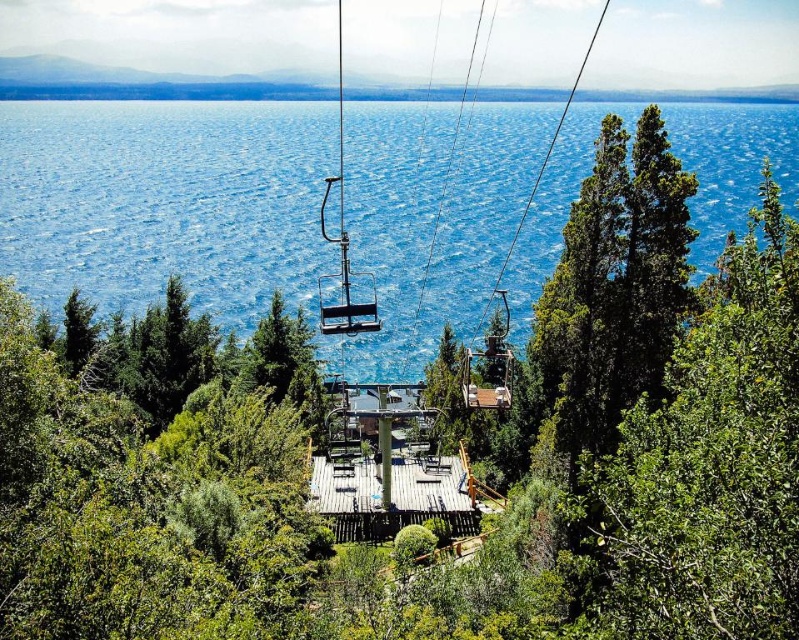
Who is taller, blue water at center or green leafy tree at right?

With more height is blue water at center.

Who is shorter, blue water at center or green leafy tree at right?

green leafy tree at right is shorter.

You are a GUI agent. You are given a task and a screenshot of the screen. Output one action in this format:
    pyautogui.click(x=<x>, y=<y>)
    Task: Click on the blue water at center
    The height and width of the screenshot is (640, 799).
    Given the screenshot: What is the action you would take?
    coord(165,202)

Is blue water at center thinner than metallic silver ski lift at center?

In fact, blue water at center might be wider than metallic silver ski lift at center.

Is blue water at center to the left of metallic silver ski lift at center from the viewer's perspective?

Yes, blue water at center is to the left of metallic silver ski lift at center.

Who is more forward, (14, 268) or (555, 140)?

Point (14, 268) is more forward.

The height and width of the screenshot is (640, 799). I want to click on blue water at center, so click(165, 202).

Is green leafy tree at right below metallic silver ski lift at center?

Correct, green leafy tree at right is located below metallic silver ski lift at center.

Can you confirm if green leafy tree at right is bigger than metallic silver ski lift at center?

No.

Does point (642, 525) lie behind point (547, 154)?

No.

You are a GUI agent. You are given a task and a screenshot of the screen. Output one action in this format:
    pyautogui.click(x=<x>, y=<y>)
    Task: Click on the green leafy tree at right
    The height and width of the screenshot is (640, 799).
    Given the screenshot: What is the action you would take?
    pyautogui.click(x=706, y=461)